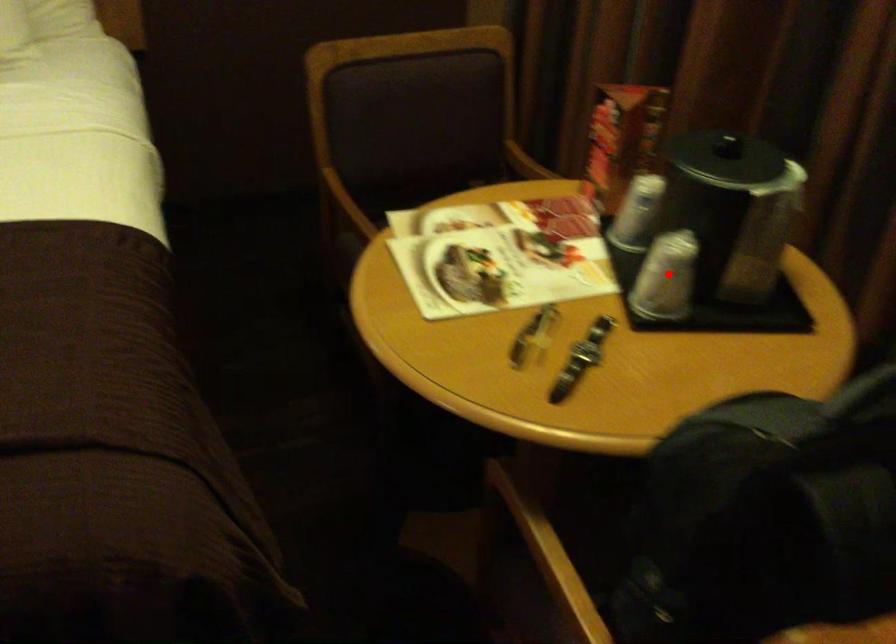
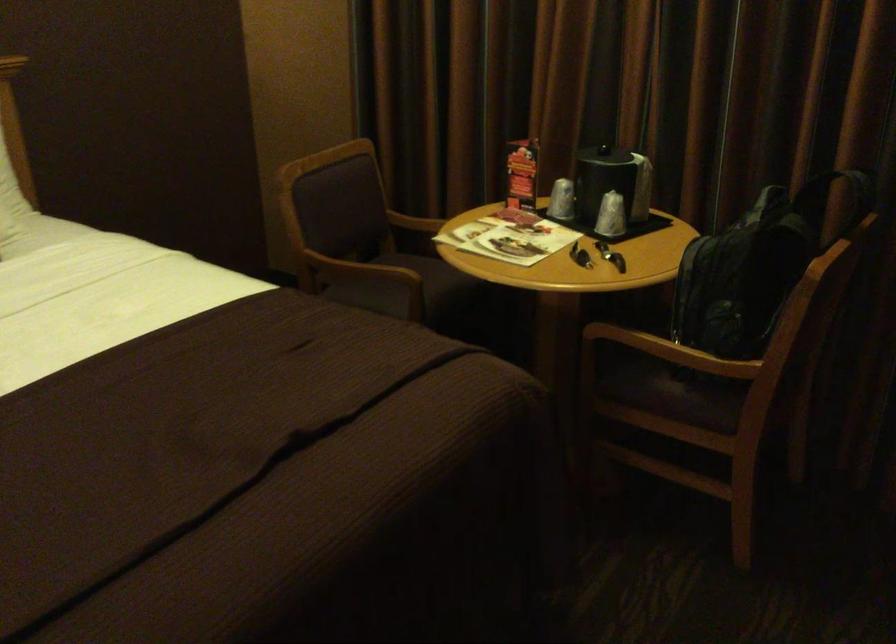
Locate, in the second image, the point that corresponds to the highlighted location in the first image.

(610, 216)